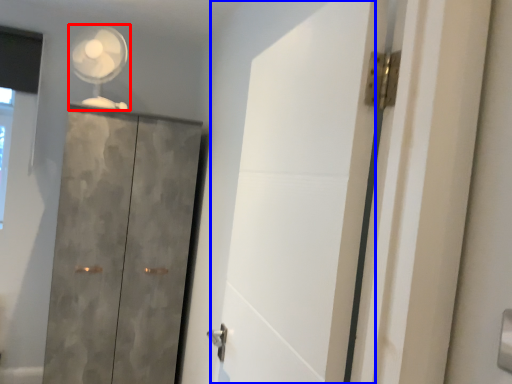
Question: Which of the following is the closest to the observer, mechanical fan (highlighted by a red box) or screen door (highlighted by a blue box)?

Choices:
 (A) mechanical fan
 (B) screen door

Answer: (B)